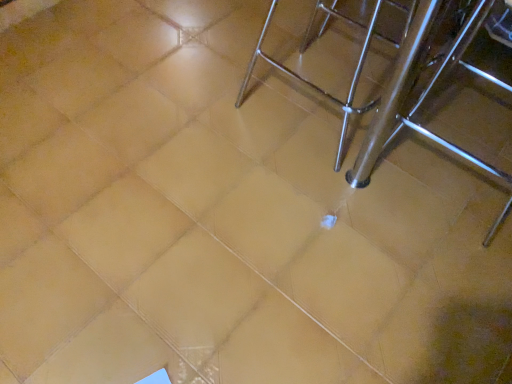
Question: Considering the positions of point (411, 14) and point (259, 48), is point (411, 14) closer or farther from the camera than point (259, 48)?

Choices:
 (A) closer
 (B) farther

Answer: (B)

Question: Considering the positions of silver metallic stool at center and polished metal chair at upper right in the image, is silver metallic stool at center bigger or smaller than polished metal chair at upper right?

Choices:
 (A) small
 (B) big

Answer: (B)

Question: Looking at their shapes, would you say silver metallic stool at center is wider or thinner than polished metal chair at upper right?

Choices:
 (A) thin
 (B) wide

Answer: (B)

Question: Do you think polished metal chair at upper right is within silver metallic stool at center, or outside of it?

Choices:
 (A) outside
 (B) inside

Answer: (B)

Question: From the image's perspective, is polished metal chair at upper right positioned above or below silver metallic stool at center?

Choices:
 (A) above
 (B) below

Answer: (B)

Question: Is point (251, 56) positioned closer to the camera than point (426, 39)?

Choices:
 (A) farther
 (B) closer

Answer: (B)

Question: Is polished metal chair at upper right in front of or behind silver metallic stool at center in the image?

Choices:
 (A) behind
 (B) front

Answer: (A)